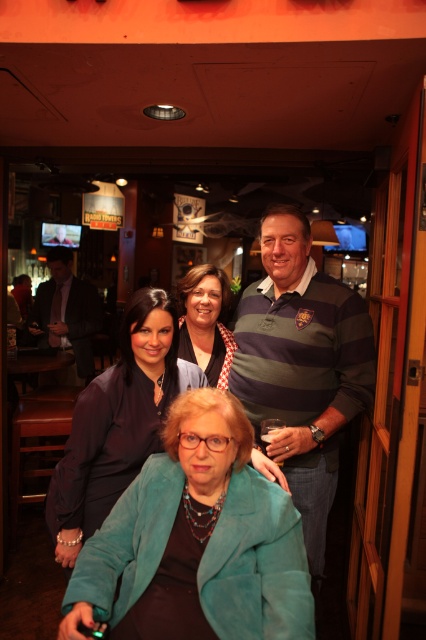
Question: Does teal suede jacket at lower left appear under teal fabric jacket at lower center?

Choices:
 (A) yes
 (B) no

Answer: (A)

Question: Among these points, which one is farthest from the camera?

Choices:
 (A) (232, 508)
 (B) (308, 401)
 (C) (187, 349)

Answer: (C)

Question: Which object is the farthest from the matte black shirt at center?

Choices:
 (A) teal fabric jacket at lower center
 (B) teal suede jacket at lower left
 (C) striped polo shirt at center
 (D) dark gray suit at left

Answer: (D)

Question: In this image, where is teal fabric jacket at lower center located relative to dark gray suit at left?

Choices:
 (A) right
 (B) left

Answer: (A)

Question: Does dark gray suit at left have a greater width compared to matte black shirt at center?

Choices:
 (A) no
 (B) yes

Answer: (B)

Question: Which point is closer to the camera taking this photo?

Choices:
 (A) pos(189,275)
 (B) pos(92,449)

Answer: (B)